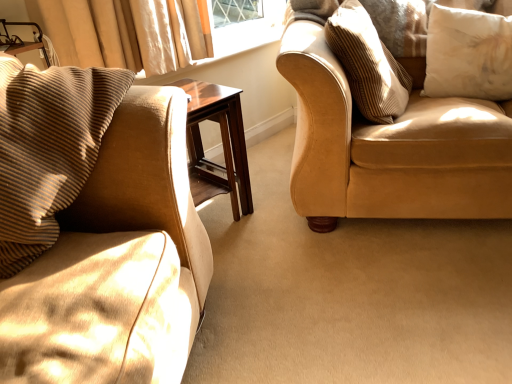
This screenshot has width=512, height=384. What do you see at coordinates (222, 141) in the screenshot?
I see `mahogany wood side table at center` at bounding box center [222, 141].

Identify the location of mahogany wood side table at center. (222, 141).

Locate an element on the screen. This screenshot has width=512, height=384. brown corduroy pillow at left, which is the 1th pillow from left to right is located at coordinates (48, 148).

At what (x,y) coordinates should I click in order to perform the action: click on striped fabric pillow at upper right, the second pillow viewed from the left. Please return your answer as a coordinate pair (x, y). This screenshot has height=384, width=512. Looking at the image, I should click on (367, 64).

Is brown corduroy pillow at left, positioned as the third pillow in right-to-left order, not within suede beige couch at right?

Yes, brown corduroy pillow at left, positioned as the third pillow in right-to-left order, is not within suede beige couch at right.

The image size is (512, 384). I want to click on studio couch on the right side of brown corduroy pillow at left, positioned as the third pillow in right-to-left order, so click(390, 146).

What's the angular difference between brown corduroy pillow at left, which is the 1th pillow from left to right, and suede beige couch at right's facing directions?

32.5 degrees.

Is brown corduroy pillow at left, positioned as the third pillow in right-to-left order, placed right next to suede beige couch at right?

No, brown corduroy pillow at left, positioned as the third pillow in right-to-left order, is not making contact with suede beige couch at right.

How different are the orientations of striped fabric pillow at upper right, acting as the 2th pillow starting from the right, and white soft cushion at upper right, which ranks as the third pillow in left-to-right order, in degrees?

They differ by 82.1 degrees in their facing directions.

Does point (362, 13) come in front of point (481, 93)?

That is True.

Relative to white soft cushion at upper right, which ranks as the third pillow in left-to-right order, is striped fabric pillow at upper right, acting as the 2th pillow starting from the right, in front or behind?

In the image, striped fabric pillow at upper right, acting as the 2th pillow starting from the right, appears in front of white soft cushion at upper right, which ranks as the third pillow in left-to-right order.

Does striped fabric pillow at upper right, the second pillow viewed from the left, have a lesser width compared to white soft cushion at upper right, which ranks as the third pillow in left-to-right order?

Incorrect, the width of striped fabric pillow at upper right, the second pillow viewed from the left, is not less than that of white soft cushion at upper right, which ranks as the third pillow in left-to-right order.

Is the position of white soft cushion at upper right, which ranks as the third pillow in left-to-right order, more distant than that of mahogany wood side table at center?

That is True.

From a real-world perspective, is white soft cushion at upper right, which ranks as the third pillow in left-to-right order, over mahogany wood side table at center?

Correct, in the physical world, white soft cushion at upper right, which ranks as the third pillow in left-to-right order, is higher than mahogany wood side table at center.

Can you confirm if white soft cushion at upper right, the first pillow from the right, is smaller than mahogany wood side table at center?

Yes, white soft cushion at upper right, the first pillow from the right, is smaller than mahogany wood side table at center.

Is white soft cushion at upper right, the first pillow from the right, completely or partially outside of mahogany wood side table at center?

Yes.

Considering the positions of objects suede beige couch at right and mahogany wood side table at center in the image provided, who is in front, suede beige couch at right or mahogany wood side table at center?

suede beige couch at right is in front.

Is suede beige couch at right with mahogany wood side table at center?

No, suede beige couch at right is not in contact with mahogany wood side table at center.

Which is more to the right, suede beige couch at right or mahogany wood side table at center?

From the viewer's perspective, suede beige couch at right appears more on the right side.

From a real-world perspective, which object rests below the other?

suede beige couch at right is physically lower.

Is the surface of striped fabric pillow at upper right, the second pillow viewed from the left, in direct contact with suede beige couch at right?

No, striped fabric pillow at upper right, the second pillow viewed from the left, is not touching suede beige couch at right.

Is striped fabric pillow at upper right, acting as the 2th pillow starting from the right, oriented away from suede beige couch at right?

That's right, striped fabric pillow at upper right, acting as the 2th pillow starting from the right, is facing away from suede beige couch at right.

Is striped fabric pillow at upper right, acting as the 2th pillow starting from the right, taller than suede beige couch at right?

Incorrect, the height of striped fabric pillow at upper right, acting as the 2th pillow starting from the right, is not larger of that of suede beige couch at right.

Considering the relative positions of mahogany wood side table at center and suede beige couch at right in the image provided, is mahogany wood side table at center to the right of suede beige couch at right from the viewer's perspective?

In fact, mahogany wood side table at center is to the left of suede beige couch at right.

Based on the photo, is mahogany wood side table at center positioned far away from suede beige couch at right?

No, mahogany wood side table at center is not far away from suede beige couch at right.

This screenshot has width=512, height=384. There is a mahogany wood side table at center. Find the location of `studio couch above it (from a real-world perspective)`. studio couch above it (from a real-world perspective) is located at coordinates (390, 146).

From the image's perspective, is mahogany wood side table at center located above or below suede beige couch at right?

mahogany wood side table at center is situated lower than suede beige couch at right in the image.

Is suede beige couch at right thinner than striped fabric pillow at upper right, the second pillow viewed from the left?

No.

Is point (367, 156) more distant than point (340, 17)?

No.

Measure the distance between suede beige couch at right and striped fabric pillow at upper right, the second pillow viewed from the left.

suede beige couch at right is 6.63 inches from striped fabric pillow at upper right, the second pillow viewed from the left.

Locate an element on the screen. studio couch on the right of brown corduroy pillow at left, which is the 1th pillow from left to right is located at coordinates (390, 146).

Image resolution: width=512 pixels, height=384 pixels. In order to click on pillow behind the striped fabric pillow at upper right, the second pillow viewed from the left in this screenshot , I will do `click(468, 54)`.

Looking at the image, which one is located closer to suede beige couch at right, mahogany wood side table at center or striped fabric pillow at upper right, the second pillow viewed from the left?

striped fabric pillow at upper right, the second pillow viewed from the left.

From the image, which object appears to be nearer to suede beige couch at right, white soft cushion at upper right, the first pillow from the right, or mahogany wood side table at center?

white soft cushion at upper right, the first pillow from the right, is positioned closer to the anchor suede beige couch at right.

Looking at the image, which one is located closer to white soft cushion at upper right, the first pillow from the right, brown corduroy pillow at left, which is the 1th pillow from left to right, or striped fabric pillow at upper right, acting as the 2th pillow starting from the right?

striped fabric pillow at upper right, acting as the 2th pillow starting from the right, is closer to white soft cushion at upper right, the first pillow from the right.

Estimate the real-world distances between objects in this image. Which object is further from striped fabric pillow at upper right, the second pillow viewed from the left, mahogany wood side table at center or suede beige couch at right?

Based on the image, mahogany wood side table at center appears to be further to striped fabric pillow at upper right, the second pillow viewed from the left.

Which object lies nearer to the anchor point white soft cushion at upper right, which ranks as the third pillow in left-to-right order, striped fabric pillow at upper right, acting as the 2th pillow starting from the right, or mahogany wood side table at center?

striped fabric pillow at upper right, acting as the 2th pillow starting from the right.

Considering their positions, is white soft cushion at upper right, the first pillow from the right, positioned further to mahogany wood side table at center than striped fabric pillow at upper right, the second pillow viewed from the left?

The object further to mahogany wood side table at center is white soft cushion at upper right, the first pillow from the right.

From the image, which object appears to be nearer to white soft cushion at upper right, the first pillow from the right, suede beige couch at right or mahogany wood side table at center?

Among the two, suede beige couch at right is located nearer to white soft cushion at upper right, the first pillow from the right.

When comparing their distances from suede beige couch at right, does brown corduroy pillow at left, positioned as the third pillow in right-to-left order, or striped fabric pillow at upper right, acting as the 2th pillow starting from the right, seem further?

Based on the image, brown corduroy pillow at left, positioned as the third pillow in right-to-left order, appears to be further to suede beige couch at right.

Where is `pillow between mahogany wood side table at center and white soft cushion at upper right, which ranks as the third pillow in left-to-right order, in the horizontal direction`? This screenshot has height=384, width=512. pillow between mahogany wood side table at center and white soft cushion at upper right, which ranks as the third pillow in left-to-right order, in the horizontal direction is located at coordinates (367, 64).

You are a GUI agent. You are given a task and a screenshot of the screen. Output one action in this format:
    pyautogui.click(x=<x>, y=<y>)
    Task: Click on the pillow between brown corduroy pillow at left, positioned as the third pillow in right-to-left order, and white soft cushion at upper right, the first pillow from the right
    The width and height of the screenshot is (512, 384).
    Given the screenshot: What is the action you would take?
    pyautogui.click(x=367, y=64)

Where is `pillow between mahogany wood side table at center and suede beige couch at right in the horizontal direction`? pillow between mahogany wood side table at center and suede beige couch at right in the horizontal direction is located at coordinates (367, 64).

Where is `table located between brown corduroy pillow at left, positioned as the third pillow in right-to-left order, and striped fabric pillow at upper right, the second pillow viewed from the left, in the left-right direction`? table located between brown corduroy pillow at left, positioned as the third pillow in right-to-left order, and striped fabric pillow at upper right, the second pillow viewed from the left, in the left-right direction is located at coordinates (222, 141).